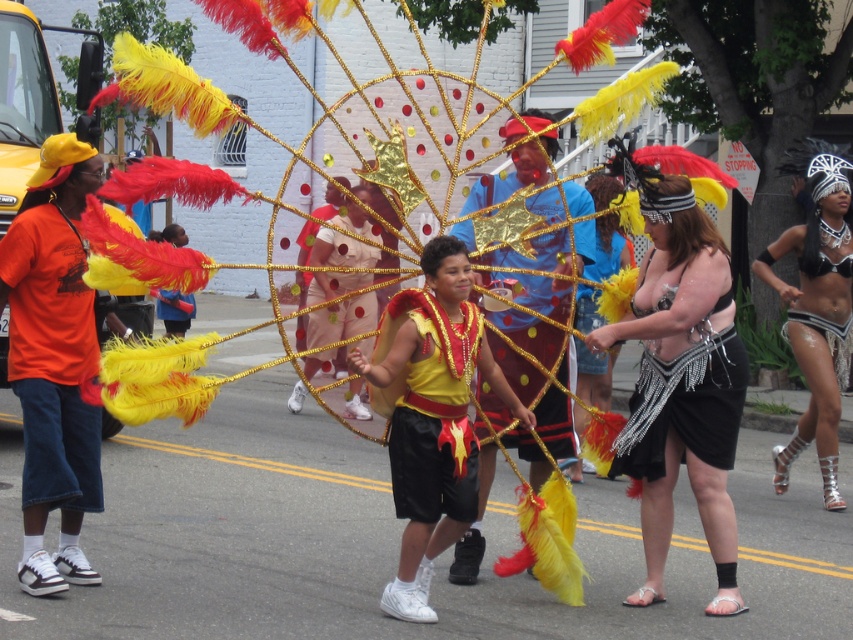
Question: Based on their relative distances, which object is nearer to the matte blue shirt at center?

Choices:
 (A) gold sequined dress at center
 (B) shiny silver sandals at lower right
 (C) yellow satin vest at center

Answer: (C)

Question: Among these points, which one is farthest from the camera?

Choices:
 (A) (22, 225)
 (B) (780, 445)
 (C) (660, 198)

Answer: (B)

Question: Is shiny black skirt at center bigger than yellow satin vest at center?

Choices:
 (A) no
 (B) yes

Answer: (B)

Question: Which point is farther to the camera?

Choices:
 (A) (811, 339)
 (B) (434, 481)

Answer: (A)

Question: Does shiny black skirt at center have a larger size compared to gold sequined dress at center?

Choices:
 (A) no
 (B) yes

Answer: (A)

Question: Is orange cotton shirt at left to the left of gold sequined dress at center from the viewer's perspective?

Choices:
 (A) no
 (B) yes

Answer: (B)